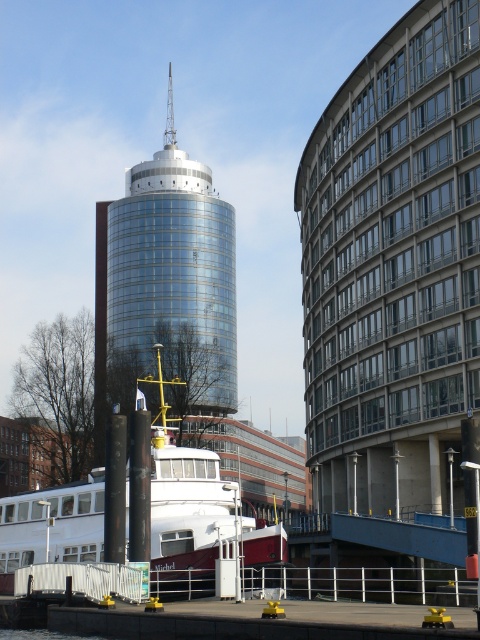
Is shiny glass tower at center to the right of white glossy boat at center from the viewer's perspective?

No, shiny glass tower at center is not to the right of white glossy boat at center.

Is shiny glass tower at center thinner than white glossy boat at center?

In fact, shiny glass tower at center might be wider than white glossy boat at center.

Does point (152, 214) lie in front of point (188, 548)?

That is False.

Locate an element on the screen. shiny glass tower at center is located at coordinates click(166, 285).

Which is more to the right, shiny glass tower at center or transparent water at lower left?

From the viewer's perspective, transparent water at lower left appears more on the right side.

Is shiny glass tower at center smaller than transparent water at lower left?

No, shiny glass tower at center is not smaller than transparent water at lower left.

Between point (164, 138) and point (16, 634), which one is positioned in front?

Point (16, 634) is in front.

Locate an element on the screen. shiny glass tower at center is located at coordinates (166, 285).

The width and height of the screenshot is (480, 640). In order to click on white glossy boat at center in this screenshot , I will do `click(187, 513)`.

Can you confirm if white glossy boat at center is positioned above transparent water at lower left?

Yes, white glossy boat at center is above transparent water at lower left.

I want to click on white glossy boat at center, so click(x=187, y=513).